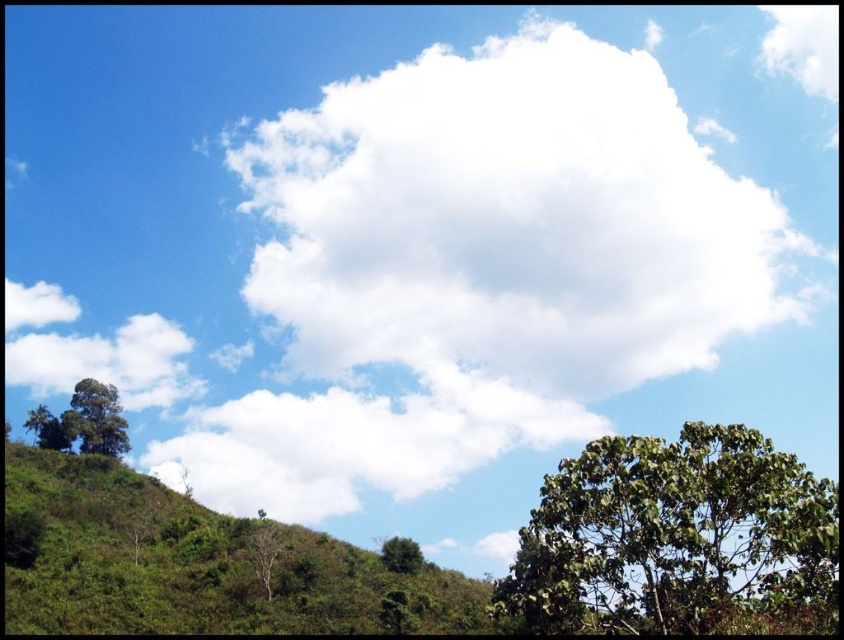
Who is positioned more to the right, white fluffy cloud at upper center or green leafy hillside at lower left?

white fluffy cloud at upper center is more to the right.

Where is `white fluffy cloud at upper center`? white fluffy cloud at upper center is located at coordinates (511, 220).

You are a GUI agent. You are given a task and a screenshot of the screen. Output one action in this format:
    pyautogui.click(x=<x>, y=<y>)
    Task: Click on the white fluffy cloud at upper center
    
    Given the screenshot: What is the action you would take?
    pyautogui.click(x=511, y=220)

Who is more forward, (544, 404) or (30, 426)?

Point (544, 404) is more forward.

Where is `white fluffy cloud at center`? The image size is (844, 640). white fluffy cloud at center is located at coordinates (358, 442).

At what (x,y) coordinates should I click in order to perform the action: click on white fluffy cloud at center. Please return your answer as a coordinate pair (x, y). Looking at the image, I should click on (358, 442).

Looking at this image, is white fluffy cloud at upper center below green leafy tree at lower left?

No.

From the picture: Who is shorter, white fluffy cloud at upper center or green leafy tree at lower left?

green leafy tree at lower left

Locate an element on the screen. The width and height of the screenshot is (844, 640). white fluffy cloud at upper center is located at coordinates [511, 220].